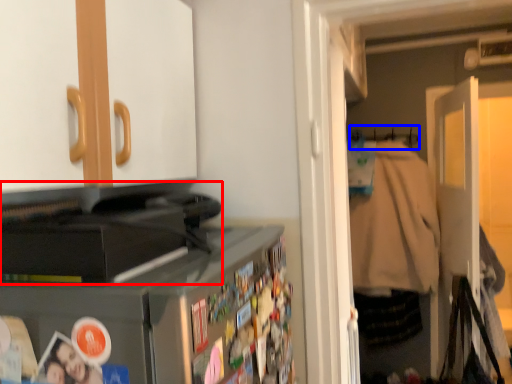
Question: Which object is further to the camera taking this photo, appliance (highlighted by a red box) or hanger (highlighted by a blue box)?

Choices:
 (A) appliance
 (B) hanger

Answer: (B)